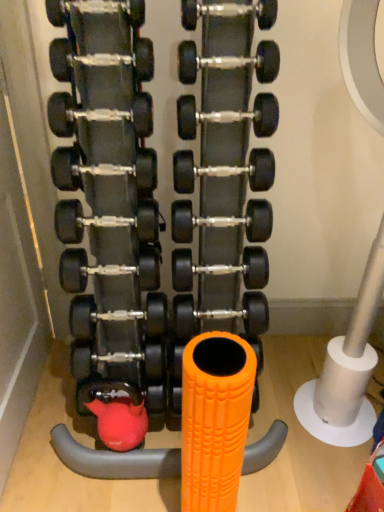
Question: From the image's perspective, is orange textured foam roller at center positioned above or below black rubber dumbbell at center, arranged as the eleventh dumbbell when viewed from the top?

Choices:
 (A) below
 (B) above

Answer: (B)

Question: Looking at the image, does orange textured foam roller at center seem bigger or smaller compared to black rubber dumbbell at center, which is the 5th dumbbell in bottom-to-top order?

Choices:
 (A) small
 (B) big

Answer: (B)

Question: Considering the real-world distances, which object is closest to the polished silver dumbbell at center, positioned as the 15th dumbbell in top-to-bottom order?

Choices:
 (A) matte black dumbbell at upper center, which ranks as the 2th dumbbell in top-to-bottom order
 (B) black rubber dumbbell at center, the 13th dumbbell ordered from the bottom
 (C) orange textured foam roller at center
 (D) black rubber dumbbell at center, which is counted as the 4th dumbbell, starting from the top
 (E) black rubber dumbbell at upper center, the 15th dumbbell in the bottom-to-top sequence

Answer: (C)

Question: Which object is positioned closest to the black rubber dumbbell at center, acting as the 4th dumbbell starting from the bottom?

Choices:
 (A) orange textured foam roller at center
 (B) black rubber dumbbell at center, the 13th dumbbell ordered from the bottom
 (C) black rubber dumbbell at center, positioned as the 6th dumbbell in bottom-to-top order
 (D) black rubber dumbbell at center, which is the 8th dumbbell from top to bottom
 (E) black rubber dumbbell at center, the 6th dumbbell when ordered from top to bottom

Answer: (C)